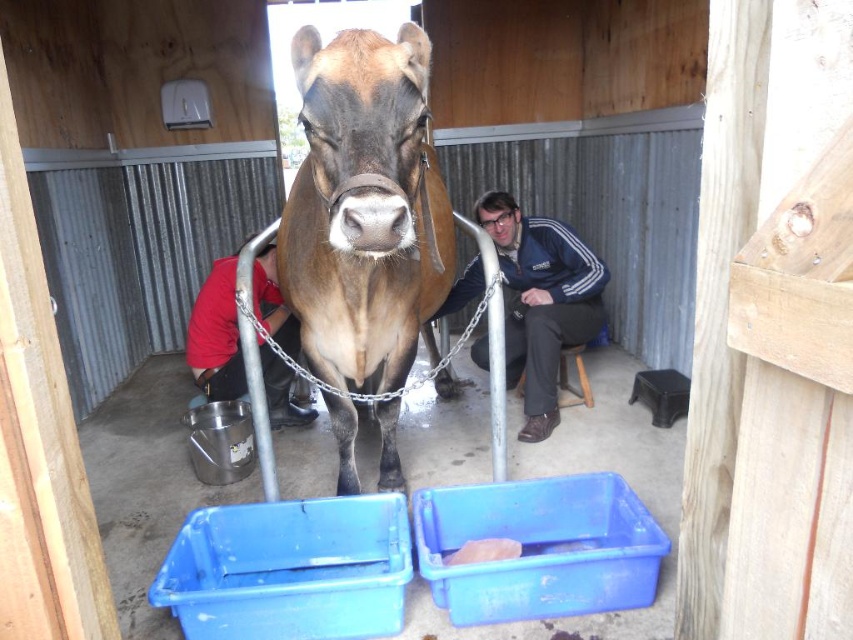
Question: Is brown glossy cow at center in front of blue fabric jacket at center?

Choices:
 (A) yes
 (B) no

Answer: (A)

Question: Estimate the real-world distances between objects in this image. Which object is closer to the brown glossy cow at center?

Choices:
 (A) blue fabric jacket at center
 (B) red shirt at lower left

Answer: (A)

Question: Which object is the farthest from the brown glossy cow at center?

Choices:
 (A) blue fabric jacket at center
 (B) red shirt at lower left

Answer: (B)

Question: Among these points, which one is farthest from the camera?

Choices:
 (A) (514, 305)
 (B) (334, 288)
 (C) (219, 396)

Answer: (A)

Question: Can you confirm if brown glossy cow at center is wider than red shirt at lower left?

Choices:
 (A) no
 (B) yes

Answer: (B)

Question: From the image, what is the correct spatial relationship of brown glossy cow at center in relation to red shirt at lower left?

Choices:
 (A) above
 (B) below

Answer: (A)